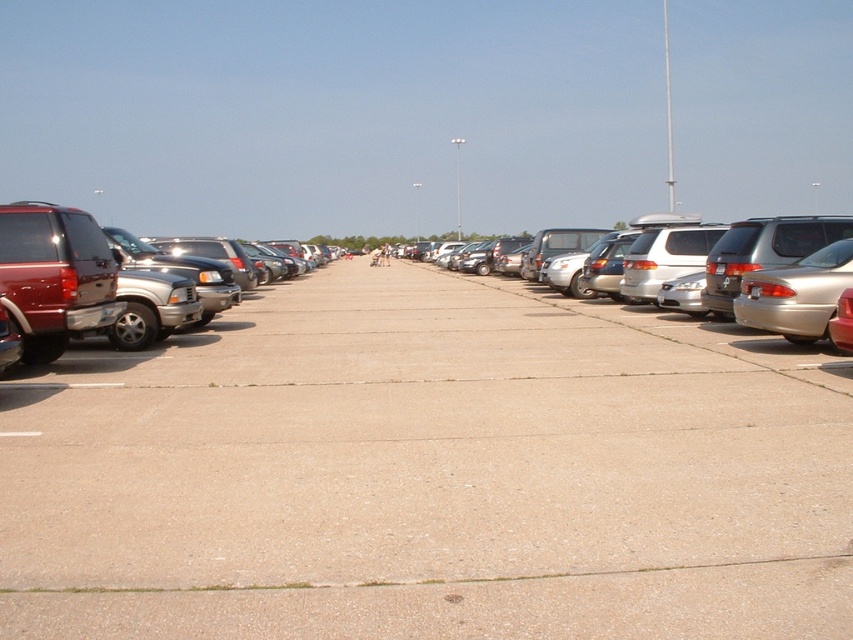
You are a delivery person trying to park your van between the shiny metallic suv at left and the metallic silver sedan at right. Since your van is 1.8 meters tall, will it fit under the gap between these two vehicles?

The shiny metallic suv at left is much taller as metallic silver sedan at right, so the gap between them is determined by the lower vehicle. Since the metallic silver sedan at right is shorter, the gap height would be its height. However, without specific height measurements, we can infer that if the sedan is under 1.8 meters tall, the van might not fit. But since the SUV is taller, the actual clearance might be the sedan height. This requires more precise data.

You are standing at the entrance of the parking lot and see the point marked at coordinates (430, 474). What type of surface is located at that point?

The point at coordinates (430, 474) corresponds to gray concrete pavement at center.

You need to park your car in the parking lot. You see the gray concrete pavement at center and the shiny metallic suv at left. Which area has a wider space available for parking?

The gray concrete pavement at center has a wider space available for parking since its width is larger than that of the shiny metallic suv at left.